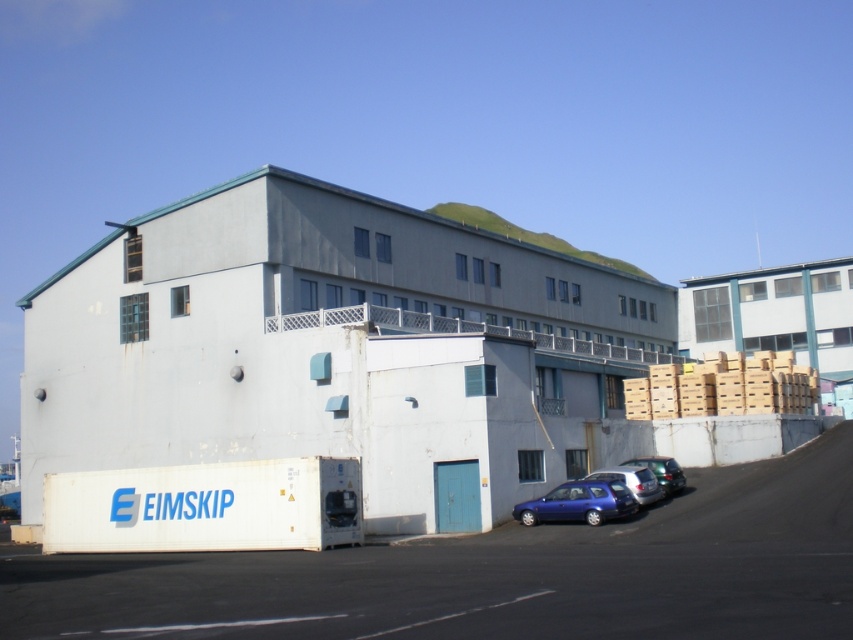
Question: Is metallic blue hatchback at lower center positioned at the back of metallic silver car at lower right?

Choices:
 (A) yes
 (B) no

Answer: (B)

Question: Which point appears farthest from the camera in this image?

Choices:
 (A) (674, 481)
 (B) (660, 490)
 (C) (616, 500)

Answer: (A)

Question: Which object is farther from the camera taking this photo?

Choices:
 (A) metallic silver car at lower right
 (B) metallic blue hatchback at lower center

Answer: (A)

Question: Where is metallic blue hatchback at lower center located in relation to metallic silver car at lower right in the image?

Choices:
 (A) above
 (B) below

Answer: (A)

Question: Is metallic blue hatchback at lower center closer to camera compared to metallic silver car at lower right?

Choices:
 (A) yes
 (B) no

Answer: (A)

Question: Which of the following is the closest to the observer?

Choices:
 (A) blue metallic car at center
 (B) metallic silver car at lower right
 (C) metallic blue hatchback at lower center

Answer: (C)